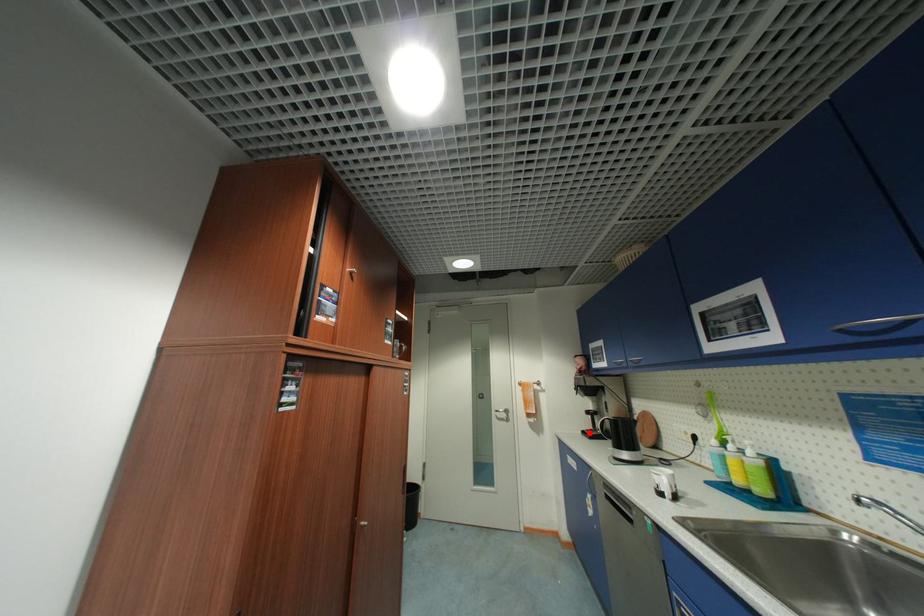
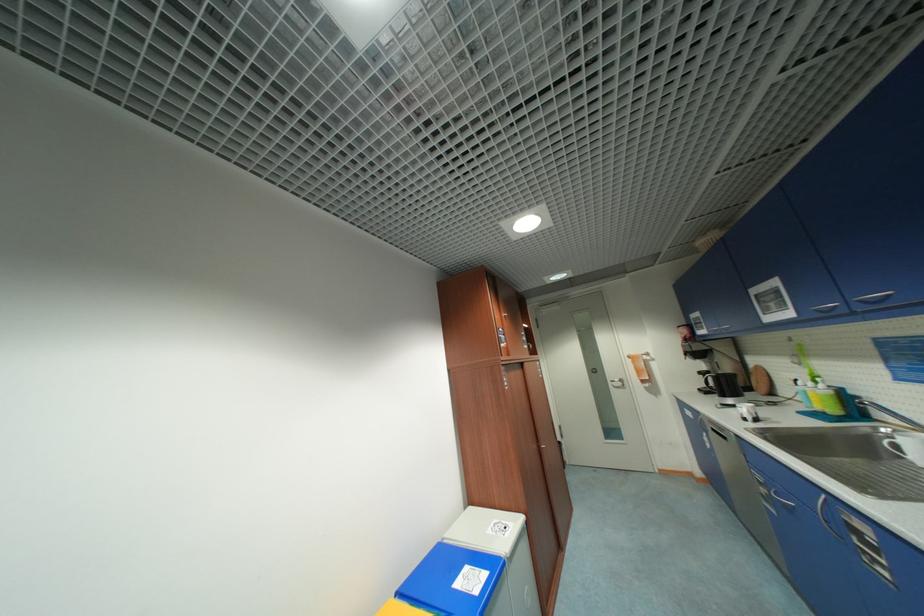
Question: I am providing you with two images of the same scene from different viewpoints. In image1, a red point is highlighted. Considering the same 3D point in image2, which of the following is correct?

Choices:
 (A) It is closer
 (B) It is farther

Answer: (A)